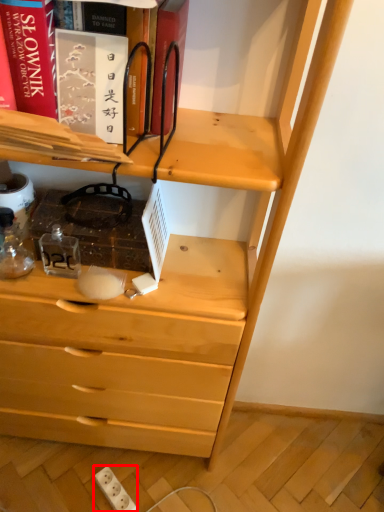
Question: From the image, what is the correct spatial relationship of electric outlet (annotated by the red box) in relation to book?

Choices:
 (A) left
 (B) right

Answer: (A)